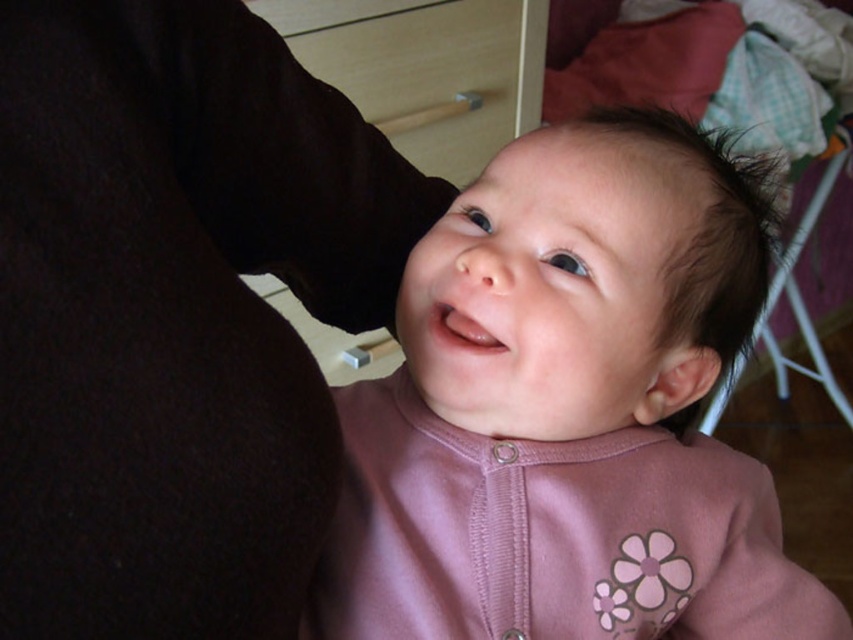
You are holding a baby and want to place a toy exactly at the point marked as point [708,291]. If the toy is 30 centimeters wide, will it fit within the space available at that point?

The point [708,291] is 50.41 centimeters away from the viewer. Since the toy is 30 centimeters wide, there is sufficient space as 50.41 cm is greater than 30 cm.

You are a photographer taking a close up photo of a baby. The baby is wearing a light pink outfit with floral designs and is being held by an adult in a dark garment. The scene also includes a wooden cabinet with a metallic handle and a covered piece of furniture to the right. Based on the coordinates provided, where exactly is the pink fabric baby at center located in the image?

The pink fabric baby at center is located at coordinates point [569,412].